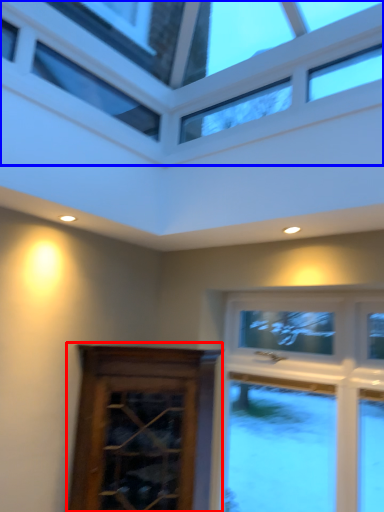
Question: Among these objects, which one is farthest to the camera, screen door (highlighted by a red box) or window (highlighted by a blue box)?

Choices:
 (A) screen door
 (B) window

Answer: (A)